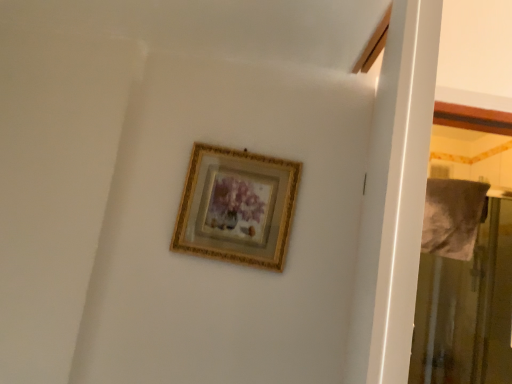
Question: Do you think transparent plastic screen door at right is within gold/gilded picture frame at upper center, or outside of it?

Choices:
 (A) outside
 (B) inside

Answer: (A)

Question: Visually, is transparent plastic screen door at right positioned to the left or to the right of gold/gilded picture frame at upper center?

Choices:
 (A) left
 (B) right

Answer: (B)

Question: Considering the positions of transparent plastic screen door at right and gold/gilded picture frame at upper center in the image, is transparent plastic screen door at right bigger or smaller than gold/gilded picture frame at upper center?

Choices:
 (A) small
 (B) big

Answer: (B)

Question: From a real-world perspective, is gold/gilded picture frame at upper center physically located above or below transparent plastic screen door at right?

Choices:
 (A) above
 (B) below

Answer: (A)

Question: Is gold/gilded picture frame at upper center spatially inside transparent plastic screen door at right, or outside of it?

Choices:
 (A) inside
 (B) outside

Answer: (B)

Question: Considering the positions of gold/gilded picture frame at upper center and transparent plastic screen door at right in the image, is gold/gilded picture frame at upper center bigger or smaller than transparent plastic screen door at right?

Choices:
 (A) big
 (B) small

Answer: (B)

Question: In terms of width, does gold/gilded picture frame at upper center look wider or thinner when compared to transparent plastic screen door at right?

Choices:
 (A) wide
 (B) thin

Answer: (B)